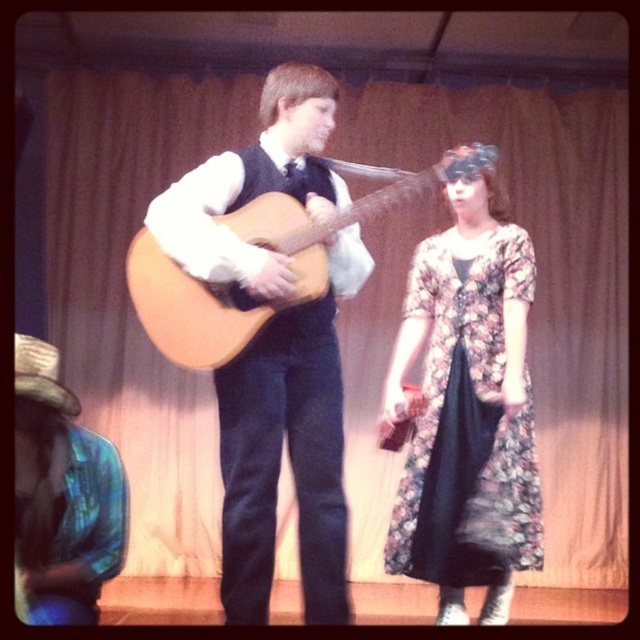
Consider the image. You are an audience member sitting in the front row of the stage. You see two guitars at center stage, a matte brown guitar at center and a light brown acoustic guitar at center. Which guitar is located to the left of the other?

The matte brown guitar at center is positioned on the left side of the light brown acoustic guitar at center.